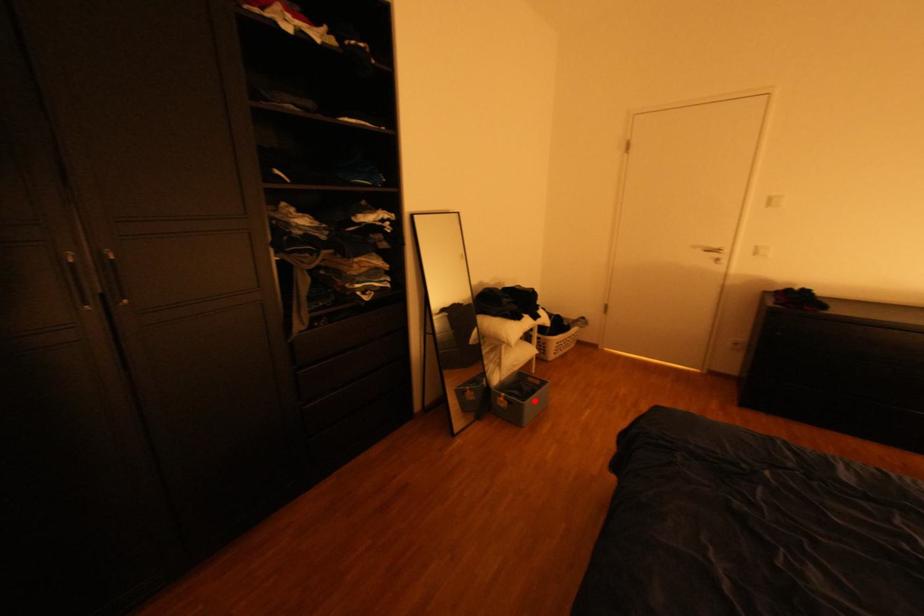
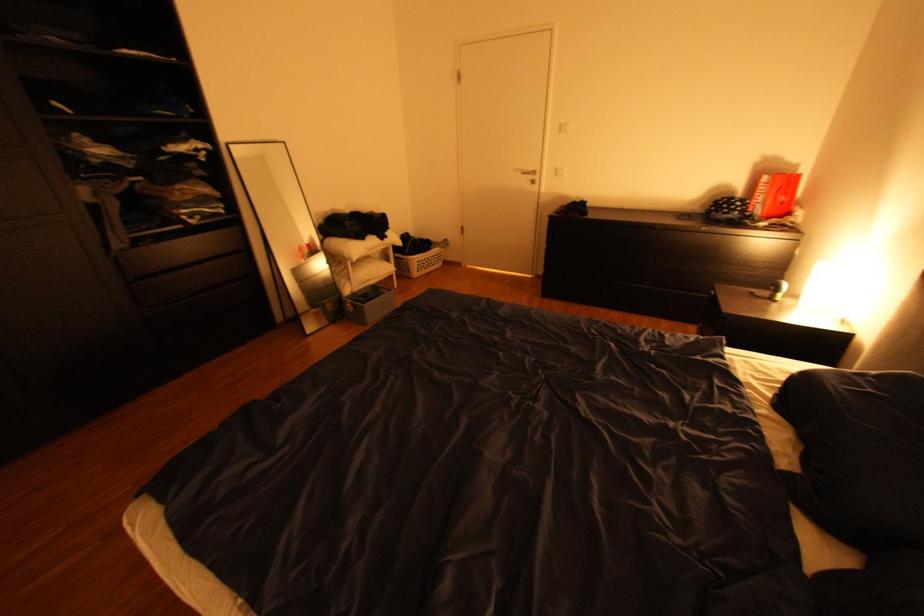
Find the pixel in the second image that matches the highlighted location in the first image.

(373, 304)